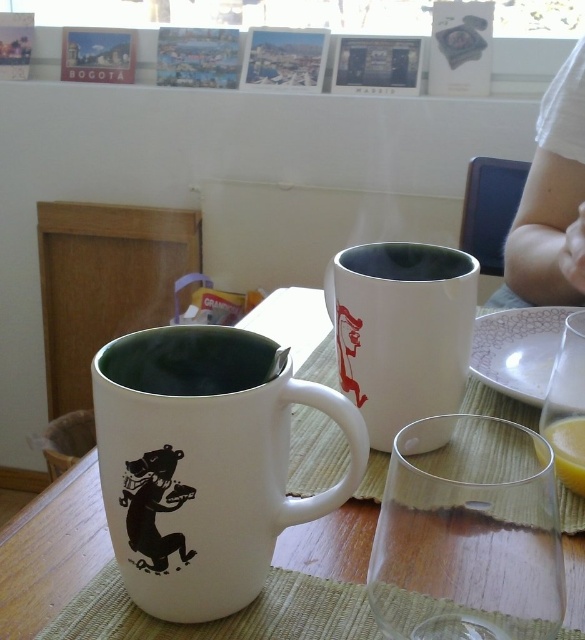
You are arranging a small dinner party and want to place a 3.5 inch wide decorative plate between the white matte mug at left and the transparent glass at center. Can you fit it without moving either item?

The distance between the white matte mug at left and the transparent glass at center is 3.20 inches, which is slightly less than the 3.5 inch width of the decorative plate. Therefore, the plate won

Where is the white glossy mug at center located in the image?

The white glossy mug at center is located at point 0.564 on the x axis and 0.326 on the y axis.